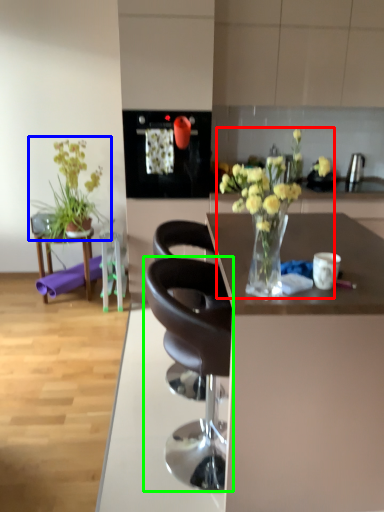
Question: Estimate the real-world distances between objects in this image. Which object is closer to floral arrangement (highlighted by a red box), houseplant (highlighted by a blue box) or chair (highlighted by a green box)?

Choices:
 (A) houseplant
 (B) chair

Answer: (B)